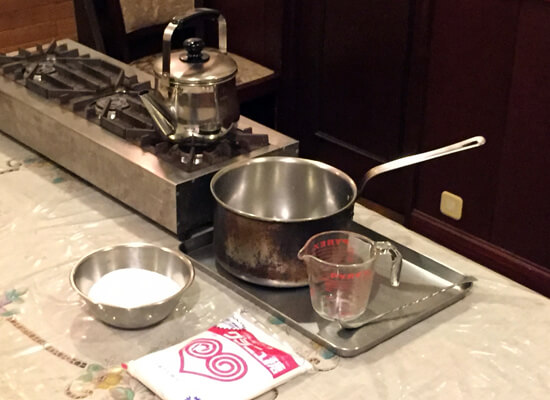
The height and width of the screenshot is (400, 550). In order to click on cup in this screenshot , I will do pyautogui.click(x=317, y=289).